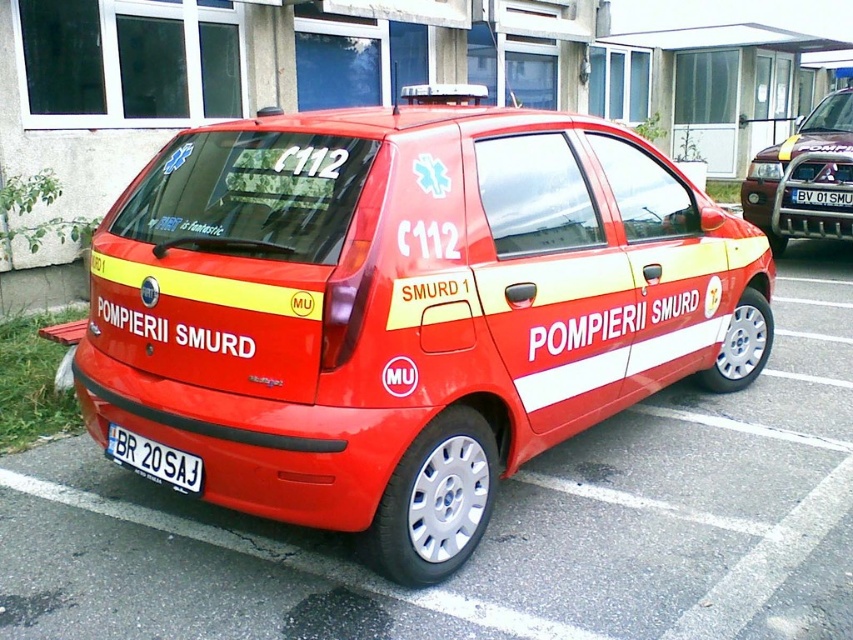
Which is more to the right, matte red car at center or white plastic license plate at center?

white plastic license plate at center

Is the position of matte red car at center less distant than that of white plastic license plate at center?

That is True.

Find the location of `matte red car at center`. matte red car at center is located at coordinates (405, 307).

Does matte red car at center have a smaller size compared to metallic silver suv at upper right?

Actually, matte red car at center might be larger than metallic silver suv at upper right.

Can you confirm if matte red car at center is shorter than metallic silver suv at upper right?

Yes.

Who is more distant from viewer, (268, 458) or (779, 196)?

The point (779, 196) is behind.

I want to click on matte red car at center, so click(405, 307).

Can you confirm if metallic silver suv at upper right is positioned below white plastic license plate at lower center?

No, metallic silver suv at upper right is not below white plastic license plate at lower center.

Can you confirm if metallic silver suv at upper right is positioned to the right of white plastic license plate at lower center?

Indeed, metallic silver suv at upper right is positioned on the right side of white plastic license plate at lower center.

Between point (762, 209) and point (177, 483), which one is positioned in front?

Point (177, 483)

I want to click on metallic silver suv at upper right, so click(804, 177).